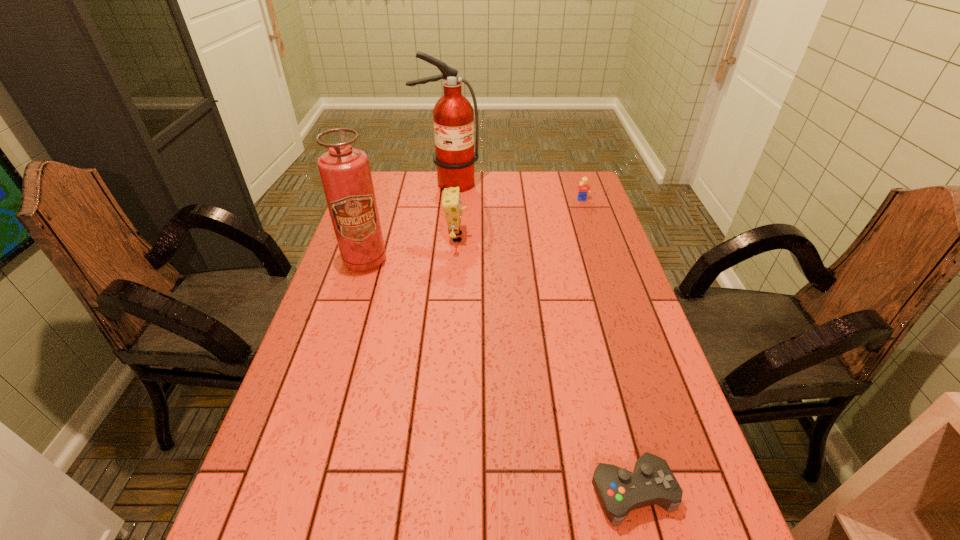
Find the location of a particular element. free space between the taller fire extinguisher and the fourth shortest object is located at coordinates (406, 222).

I want to click on free space between the left fire extinguisher and the second farthest object, so click(x=473, y=231).

You are a GUI agent. You are given a task and a screenshot of the screen. Output one action in this format:
    pyautogui.click(x=<x>, y=<y>)
    Task: Click on the free space between the third shortest object and the second shortest object
    This screenshot has width=960, height=540.
    Given the screenshot: What is the action you would take?
    pyautogui.click(x=519, y=219)

This screenshot has height=540, width=960. What are the coordinates of `free space between the third shortest object and the leftmost object` in the screenshot? It's located at (411, 249).

Identify which object is located as the second nearest to the third shortest object. Please provide its 2D coordinates. Your answer should be formatted as a tuple, i.e. [(x, y)], where the tuple contains the x and y coordinates of a point satisfying the conditions above.

[(345, 173)]

Locate an element on the screen. Image resolution: width=960 pixels, height=540 pixels. object that is the closest to the sponge is located at coordinates (453, 115).

You are a GUI agent. You are given a task and a screenshot of the screen. Output one action in this format:
    pyautogui.click(x=<x>, y=<y>)
    Task: Click on the blank space that satisfies the following two spatial constraints: 1. on the face of the sponge; 2. on the label side of the shorter fire extinguisher
    
    Given the screenshot: What is the action you would take?
    pyautogui.click(x=455, y=261)

Identify the location of vacant space that satisfies the following two spatial constraints: 1. on the back side of the nearest object; 2. on the face of the sponge. (567, 238).

This screenshot has width=960, height=540. In order to click on blank space that satisfies the following two spatial constraints: 1. on the face of the third shortest object; 2. on the left side of the control in this screenshot , I will do `click(439, 492)`.

Locate an element on the screen. free space in the image that satisfies the following two spatial constraints: 1. on the label side of the second tallest object; 2. on the right side of the control is located at coordinates 292,492.